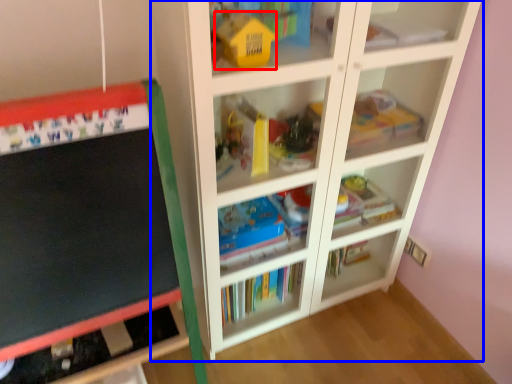
Question: Among these objects, which one is nearest to the camera, toy (highlighted by a red box) or shelf (highlighted by a blue box)?

Choices:
 (A) toy
 (B) shelf

Answer: (B)